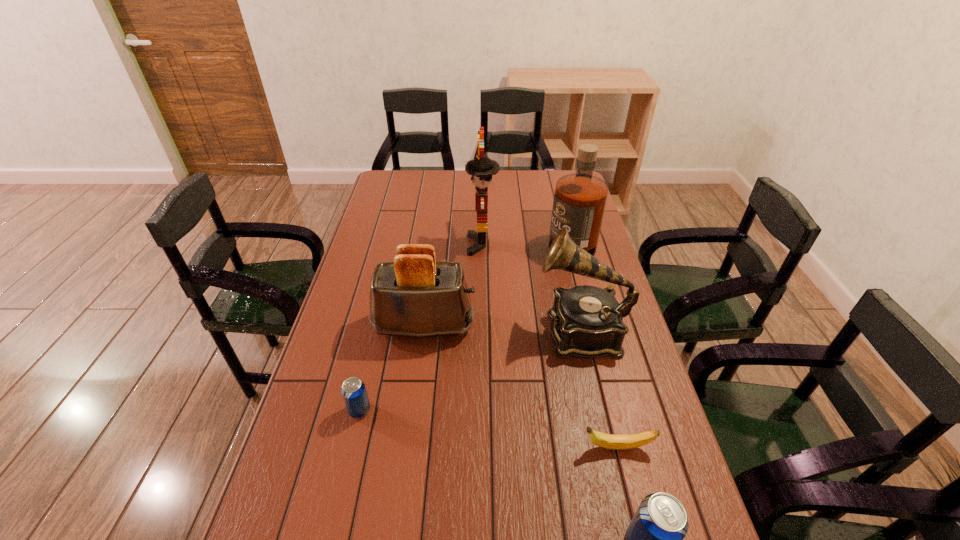
This screenshot has width=960, height=540. Identify the location of vacant area situated on the horn of the phonograph record. (514, 330).

Where is `vacant region located 0.290m on the horn of the phonograph record`? The width and height of the screenshot is (960, 540). vacant region located 0.290m on the horn of the phonograph record is located at coordinates (442, 330).

This screenshot has height=540, width=960. What are the coordinates of `vacant space situated on the front label of the liquor` in the screenshot? It's located at (468, 237).

This screenshot has height=540, width=960. Identify the location of vacant space located on the front label of the liquor. (459, 237).

Where is `vacant space located 0.290m on the front label of the liquor`? This screenshot has height=540, width=960. vacant space located 0.290m on the front label of the liquor is located at coordinates (471, 237).

Find the location of a particular element. vacant area situated on the front-facing side of the nutcracker is located at coordinates (398, 245).

This screenshot has width=960, height=540. In order to click on blank space located on the front-facing side of the nutcracker in this screenshot , I will do `click(444, 245)`.

You are a GUI agent. You are given a task and a screenshot of the screen. Output one action in this format:
    pyautogui.click(x=<x>, y=<y>)
    Task: Click on the free spot located 0.270m on the front-facing side of the nutcracker
    This screenshot has height=540, width=960.
    Given the screenshot: What is the action you would take?
    pyautogui.click(x=396, y=245)

At what (x,y) coordinates should I click in order to perform the action: click on vacant space situated on the side of the fourth shortest object with the control lever. Please return your answer as a coordinate pair (x, y). Looking at the image, I should click on (560, 325).

Identify the location of vacant area located at the stem of the banana. (507, 447).